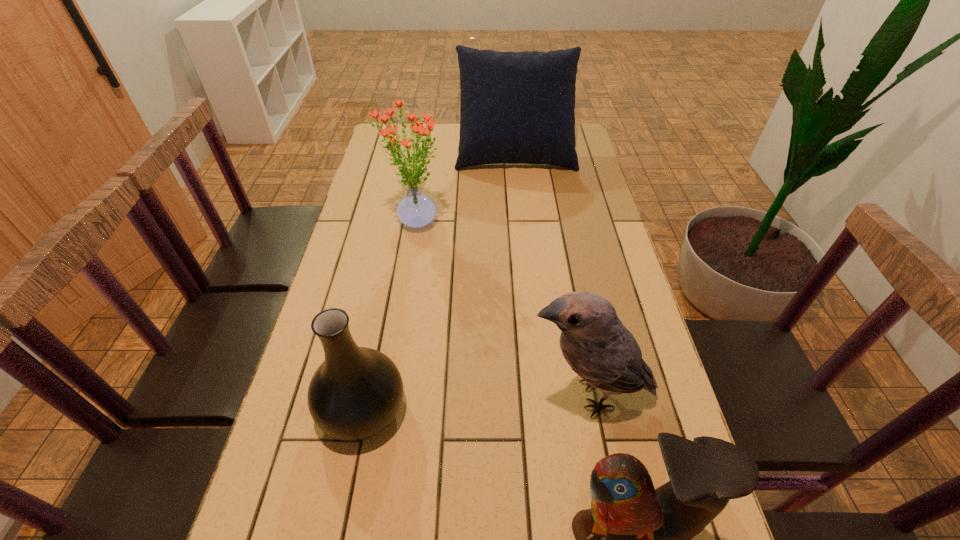
Locate an element on the screen. The width and height of the screenshot is (960, 540). free space between the fourth nearest object and the farthest object is located at coordinates click(465, 186).

Identify the location of free spot between the cushion and the farther parrot. (552, 272).

Where is `free space between the farther parrot and the vase`? free space between the farther parrot and the vase is located at coordinates (476, 401).

Where is `free space that is in between the cushion and the vase`? This screenshot has height=540, width=960. free space that is in between the cushion and the vase is located at coordinates point(439,279).

At what (x,y) coordinates should I click in order to perform the action: click on vacant area between the cushion and the vase. Please return your answer as a coordinate pair (x, y). The height and width of the screenshot is (540, 960). Looking at the image, I should click on (439, 279).

Image resolution: width=960 pixels, height=540 pixels. What are the coordinates of `the closest object to the farthest object` in the screenshot? It's located at (416, 210).

Locate an element on the screen. The height and width of the screenshot is (540, 960). object that is the second closest to the farther parrot is located at coordinates (356, 392).

Identify the location of free space that satisfies the following two spatial constraints: 1. on the back side of the flower arrangement; 2. on the left side of the vase. (399, 222).

Where is `free space that satisfies the following two spatial constraints: 1. on the back side of the flower arrangement; 2. on the right side of the vase`? The height and width of the screenshot is (540, 960). free space that satisfies the following two spatial constraints: 1. on the back side of the flower arrangement; 2. on the right side of the vase is located at coordinates coord(399,222).